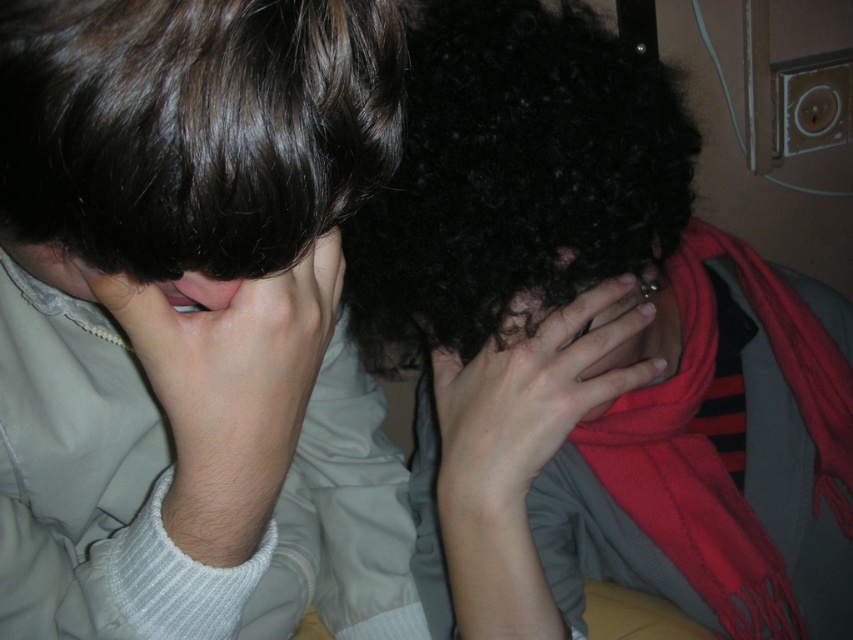
Question: Which object is the closest to the light skin/hair at left?

Choices:
 (A) curly hair at center
 (B) smooth beige shirt at left

Answer: (B)

Question: Which object is positioned farthest from the curly hair at center?

Choices:
 (A) dark brown silky hair at upper left
 (B) black curly hair at upper center
 (C) light skin/hair at left
 (D) smooth skin hand at center

Answer: (A)

Question: Among these objects, which one is nearest to the camera?

Choices:
 (A) light skin/hair at left
 (B) dark brown silky hair at upper left
 (C) black curly hair at upper center

Answer: (B)

Question: Does light skin/hair at left have a greater width compared to smooth skin hand at center?

Choices:
 (A) no
 (B) yes

Answer: (A)

Question: Can you confirm if light skin/hair at left is bigger than smooth skin hand at center?

Choices:
 (A) yes
 (B) no

Answer: (B)

Question: Does dark brown silky hair at upper left come in front of smooth skin hand at center?

Choices:
 (A) yes
 (B) no

Answer: (A)